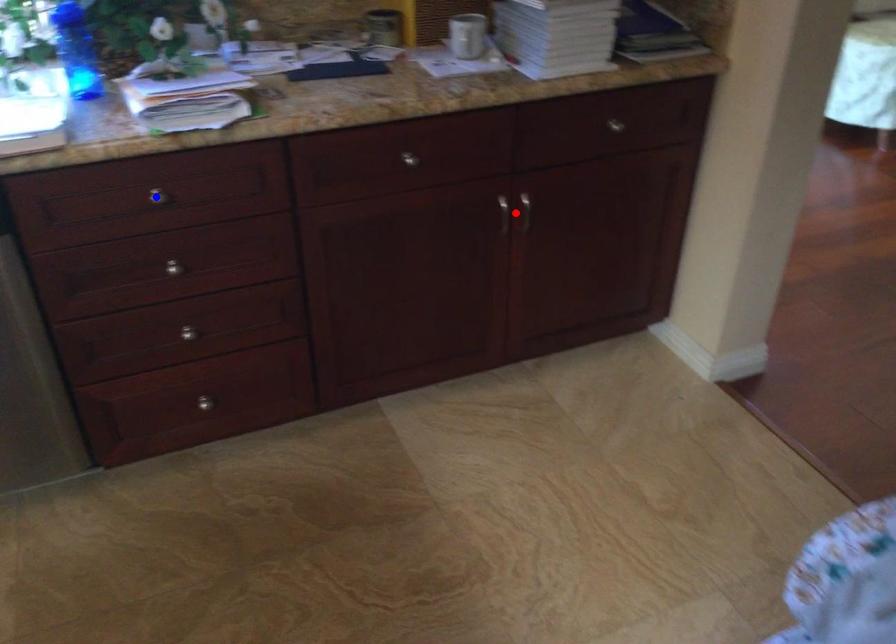
Question: Two points are marked on the image. Which point is closer to the camera?

Choices:
 (A) Blue point is closer.
 (B) Red point is closer.

Answer: (A)